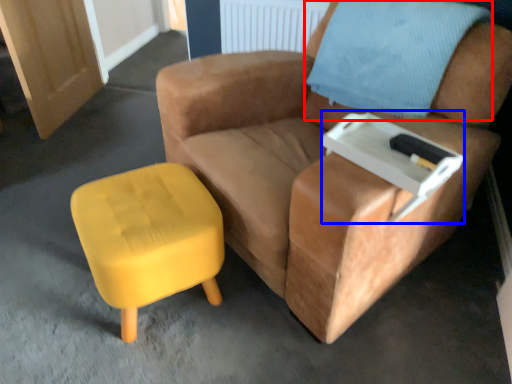
Question: Which point is closer to the camera, pillow (highlighted by a red box) or side table (highlighted by a blue box)?

Choices:
 (A) pillow
 (B) side table

Answer: (B)